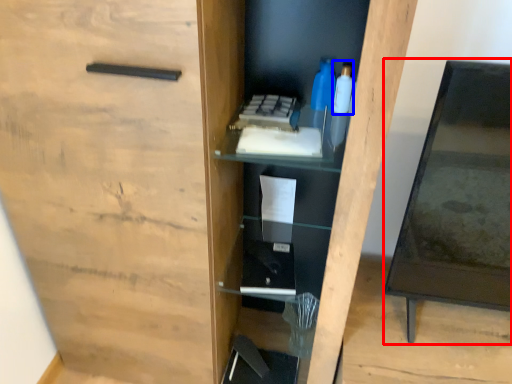
Question: Which object is closer to the camera taking this photo, table (highlighted by a red box) or bottle (highlighted by a blue box)?

Choices:
 (A) table
 (B) bottle

Answer: (A)